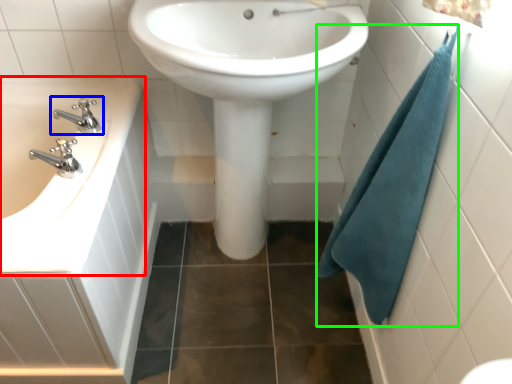
Question: Which is nearer to the sink (highlighted by a red box)? tap (highlighted by a blue box) or bath towel (highlighted by a green box).

Choices:
 (A) tap
 (B) bath towel

Answer: (A)